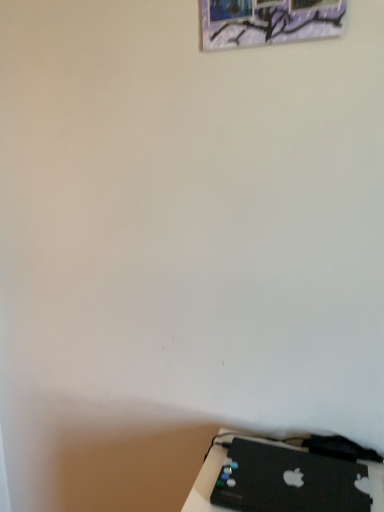
The width and height of the screenshot is (384, 512). What do you see at coordinates (291, 479) in the screenshot?
I see `black matte laptop at lower right` at bounding box center [291, 479].

This screenshot has height=512, width=384. What are the coordinates of `black matte laptop at lower right` in the screenshot? It's located at 291,479.

Describe the element at coordinates (266, 25) in the screenshot. I see `metallic silver picture frame at upper center` at that location.

Where is `metallic silver picture frame at upper center`? The image size is (384, 512). metallic silver picture frame at upper center is located at coordinates (266, 25).

Locate an element on the screen. black matte laptop at lower right is located at coordinates (291, 479).

Based on their positions, is black matte laptop at lower right located to the left or right of metallic silver picture frame at upper center?

From the image, it's evident that black matte laptop at lower right is to the right of metallic silver picture frame at upper center.

In the image, is black matte laptop at lower right positioned in front of or behind metallic silver picture frame at upper center?

black matte laptop at lower right is in front of metallic silver picture frame at upper center.

Is point (344, 471) positioned before point (230, 33)?

No, (344, 471) is behind (230, 33).

From the image's perspective, does black matte laptop at lower right appear higher than metallic silver picture frame at upper center?

No, from the image's perspective, black matte laptop at lower right is not over metallic silver picture frame at upper center.

From a real-world perspective, is black matte laptop at lower right physically below metallic silver picture frame at upper center?

Indeed, from a real-world perspective, black matte laptop at lower right is positioned beneath metallic silver picture frame at upper center.

Looking at their sizes, would you say black matte laptop at lower right is wider or thinner than metallic silver picture frame at upper center?

In the image, black matte laptop at lower right appears to be wider than metallic silver picture frame at upper center.

Considering the relative sizes of black matte laptop at lower right and metallic silver picture frame at upper center in the image provided, is black matte laptop at lower right shorter than metallic silver picture frame at upper center?

Correct, black matte laptop at lower right is not as tall as metallic silver picture frame at upper center.

Considering the relative sizes of black matte laptop at lower right and metallic silver picture frame at upper center in the image provided, is black matte laptop at lower right smaller than metallic silver picture frame at upper center?

Yes.

Is black matte laptop at lower right inside or outside of metallic silver picture frame at upper center?

black matte laptop at lower right exists outside the volume of metallic silver picture frame at upper center.

Are black matte laptop at lower right and metallic silver picture frame at upper center far apart?

No, black matte laptop at lower right is in close proximity to metallic silver picture frame at upper center.

Is black matte laptop at lower right facing away from metallic silver picture frame at upper center?

→ No, metallic silver picture frame at upper center is not at the back of black matte laptop at lower right.

How different are the orientations of black matte laptop at lower right and metallic silver picture frame at upper center in degrees?

0.00534 degrees.

Where is `laptop that is on the right side of metallic silver picture frame at upper center`? This screenshot has width=384, height=512. laptop that is on the right side of metallic silver picture frame at upper center is located at coordinates pyautogui.click(x=291, y=479).

Which object is positioned more to the left, metallic silver picture frame at upper center or black matte laptop at lower right?

metallic silver picture frame at upper center.

Which object is more forward, metallic silver picture frame at upper center or black matte laptop at lower right?

Positioned in front is black matte laptop at lower right.

Which is further, [237,3] or [231,492]?

Point [237,3]

From the image's perspective, is metallic silver picture frame at upper center located above or below black matte laptop at lower right?

Clearly, from the image's perspective, metallic silver picture frame at upper center is above black matte laptop at lower right.

From a real-world perspective, is metallic silver picture frame at upper center positioned under black matte laptop at lower right based on gravity?

Actually, metallic silver picture frame at upper center is physically above black matte laptop at lower right in the real world.

Which object is thinner, metallic silver picture frame at upper center or black matte laptop at lower right?

metallic silver picture frame at upper center is thinner.

Which of these two, metallic silver picture frame at upper center or black matte laptop at lower right, stands shorter?

Standing shorter between the two is black matte laptop at lower right.

Can you confirm if metallic silver picture frame at upper center is smaller than black matte laptop at lower right?

Incorrect, metallic silver picture frame at upper center is not smaller in size than black matte laptop at lower right.

Would you say metallic silver picture frame at upper center is outside black matte laptop at lower right?

metallic silver picture frame at upper center is positioned outside black matte laptop at lower right.

Consider the image. Is metallic silver picture frame at upper center with black matte laptop at lower right?

They are not placed beside each other.

Consider the image. Could you tell me if metallic silver picture frame at upper center is facing black matte laptop at lower right?

No, metallic silver picture frame at upper center does not turn towards black matte laptop at lower right.

Can you tell me how much metallic silver picture frame at upper center and black matte laptop at lower right differ in facing direction?

0.00534 degrees separate the facing orientations of metallic silver picture frame at upper center and black matte laptop at lower right.

Locate an element on the screen. The width and height of the screenshot is (384, 512). picture frame on the left of black matte laptop at lower right is located at coordinates (266, 25).

This screenshot has width=384, height=512. Identify the location of laptop that appears below the metallic silver picture frame at upper center (from the image's perspective). pyautogui.click(x=291, y=479).

Locate an element on the screen. This screenshot has width=384, height=512. laptop on the right side of metallic silver picture frame at upper center is located at coordinates pyautogui.click(x=291, y=479).